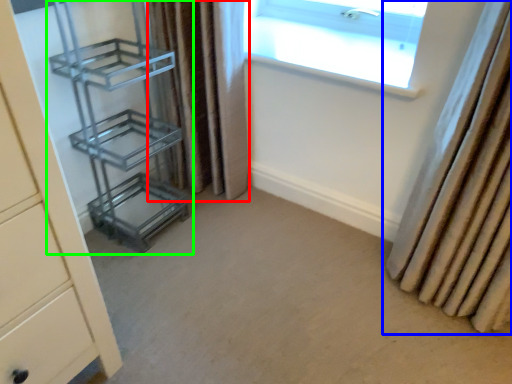
Question: Based on their relative distances, which object is nearer to curtain (highlighted by a red box)? Choose from curtain (highlighted by a blue box) and shelf (highlighted by a green box).

Choices:
 (A) curtain
 (B) shelf

Answer: (B)